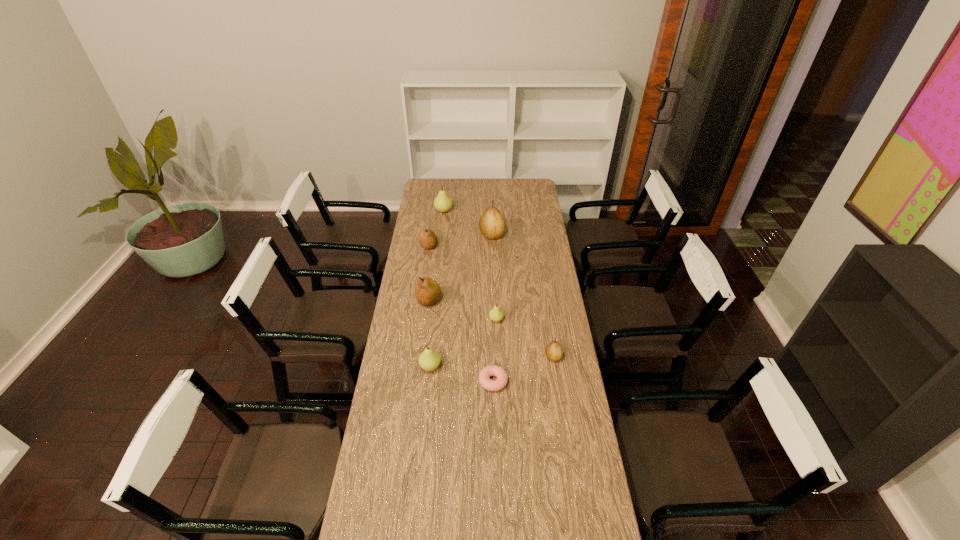
Locate an element on the screen. This screenshot has height=540, width=960. unoccupied position between the rightmost brown pear and the second biggest green pear is located at coordinates (492, 362).

Locate an element on the screen. The image size is (960, 540). free space between the tallest object and the second farthest green pear is located at coordinates (494, 277).

Where is `vacant region between the farthest object and the biggest brown pear`? Image resolution: width=960 pixels, height=540 pixels. vacant region between the farthest object and the biggest brown pear is located at coordinates [x=468, y=222].

This screenshot has height=540, width=960. What are the coordinates of `blank region between the fifth nearest object and the second smallest brown pear` in the screenshot? It's located at (429, 273).

You are a GUI agent. You are given a task and a screenshot of the screen. Output one action in this format:
    pyautogui.click(x=<x>, y=<y>)
    Task: Click on the object identified as the closest to the doughnut
    The width and height of the screenshot is (960, 540).
    Given the screenshot: What is the action you would take?
    pyautogui.click(x=429, y=360)

Where is `the sixth closest object relative to the third biggest brown pear`? Image resolution: width=960 pixels, height=540 pixels. the sixth closest object relative to the third biggest brown pear is located at coordinates coord(492,370).

You are a GUI agent. You are given a task and a screenshot of the screen. Output one action in this format:
    pyautogui.click(x=<x>, y=<y>)
    Task: Click on the pear that is the second nearest to the rightmost green pear
    
    Given the screenshot: What is the action you would take?
    pyautogui.click(x=427, y=291)

Identify which pear is the fourth closest to the doughnut. Please provide its 2D coordinates. Your answer should be formatted as a tuple, i.e. [(x, y)], where the tuple contains the x and y coordinates of a point satisfying the conditions above.

[(427, 291)]

Where is `brown pear that is the second nearest to the fifth nearest object`? brown pear that is the second nearest to the fifth nearest object is located at coordinates [492, 225].

At what (x,y) coordinates should I click in order to perform the action: click on the closest brown pear to the second smallest brown pear. Please return your answer as a coordinate pair (x, y). The width and height of the screenshot is (960, 540). Looking at the image, I should click on (492, 225).